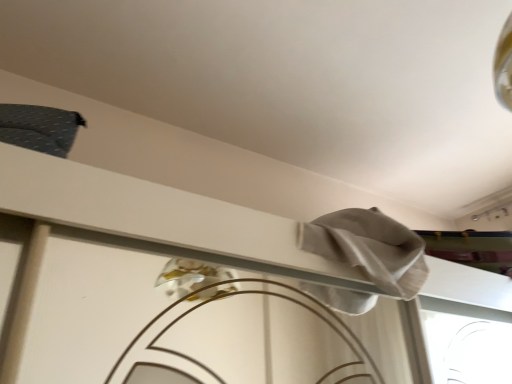
The width and height of the screenshot is (512, 384). Identify the location of white fabric at upper right. (369, 248).

What is the approximate height of white fabric at upper right?

white fabric at upper right is 10.55 inches tall.

This screenshot has width=512, height=384. What do you see at coordinates (369, 248) in the screenshot? I see `white fabric at upper right` at bounding box center [369, 248].

This screenshot has height=384, width=512. Identify the location of white fabric at upper right. (369, 248).